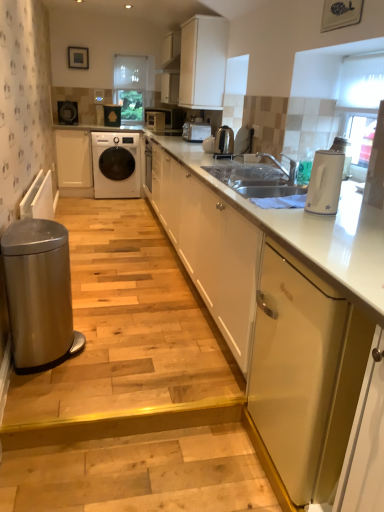
Where is `free space above stainless steel trash can at lower left, which appears as the first stair when viewed from the top (from a real-world perspective)`? The width and height of the screenshot is (384, 512). free space above stainless steel trash can at lower left, which appears as the first stair when viewed from the top (from a real-world perspective) is located at coordinates (107, 279).